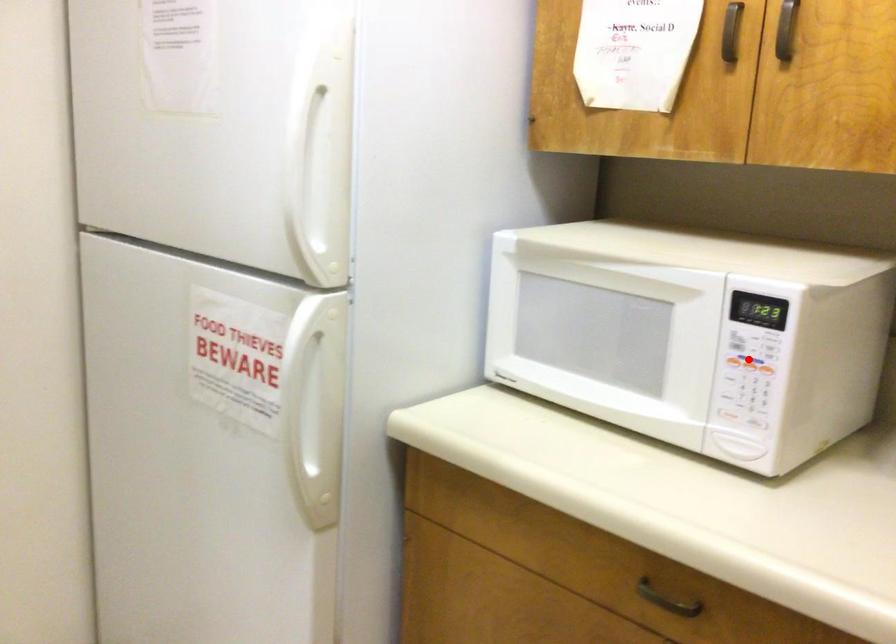
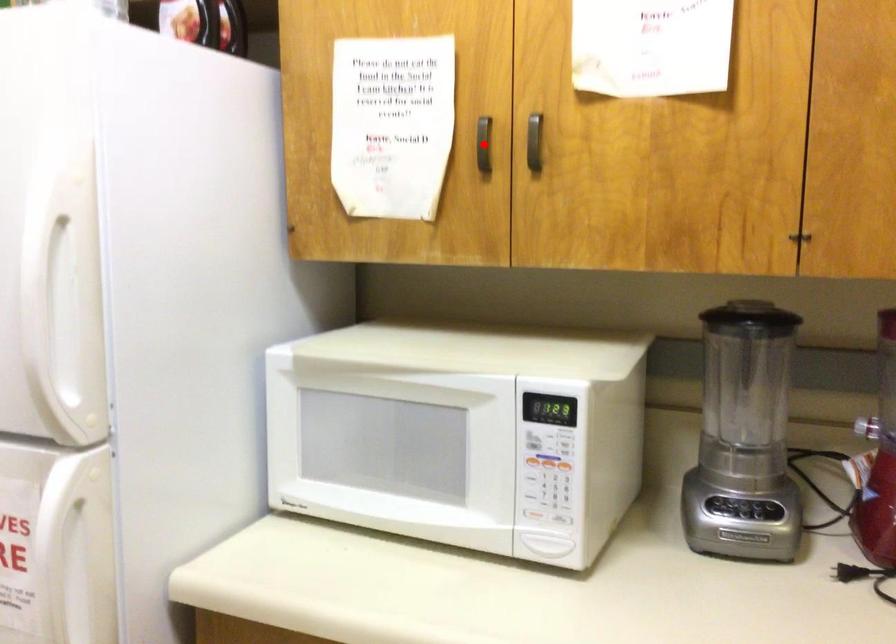
I am providing you with two images of the same scene from different viewpoints. A red point is marked on the first image and another point is marked on the second image. Do the highlighted points in image1 and image2 indicate the same real-world spot?

No